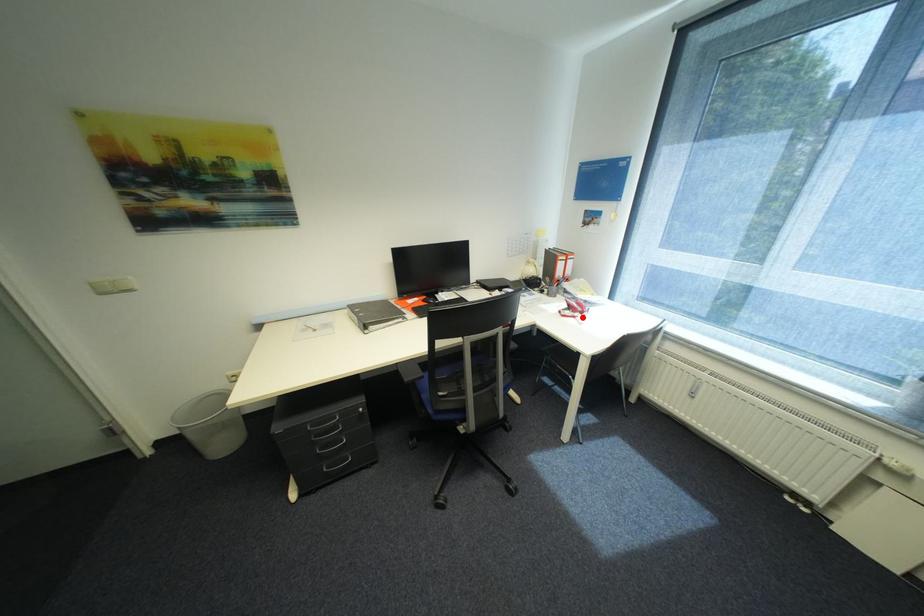
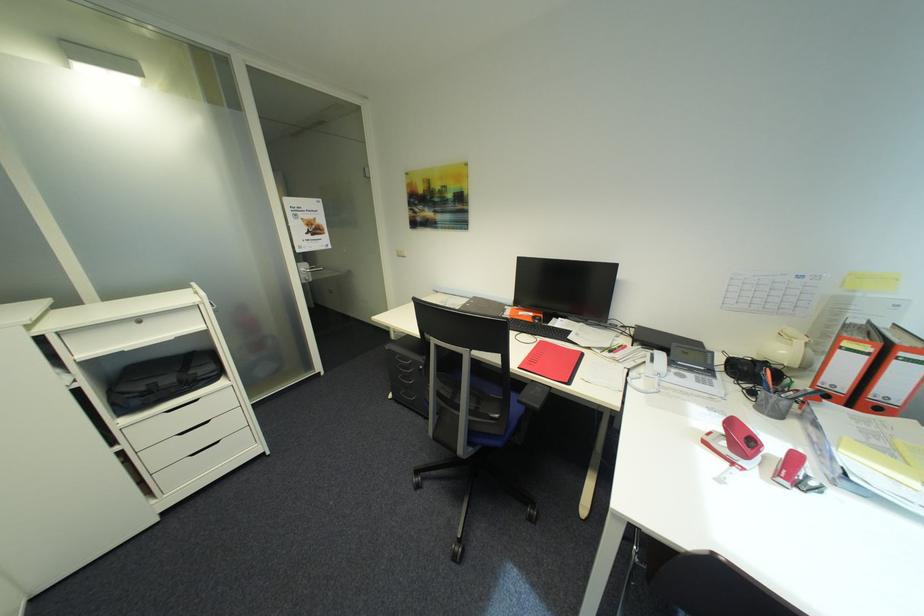
Locate, in the second image, the point that corresponds to the highlighted location in the first image.

(742, 464)